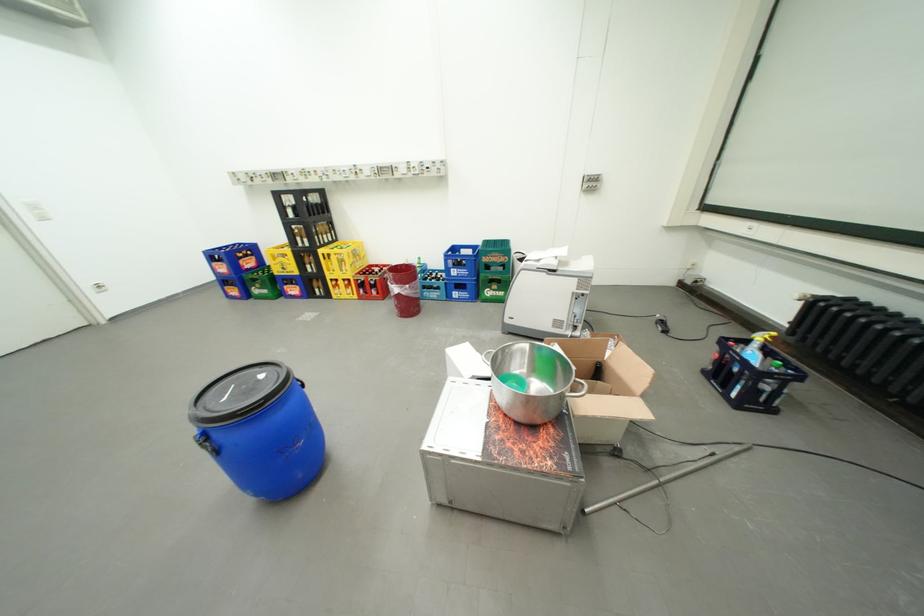
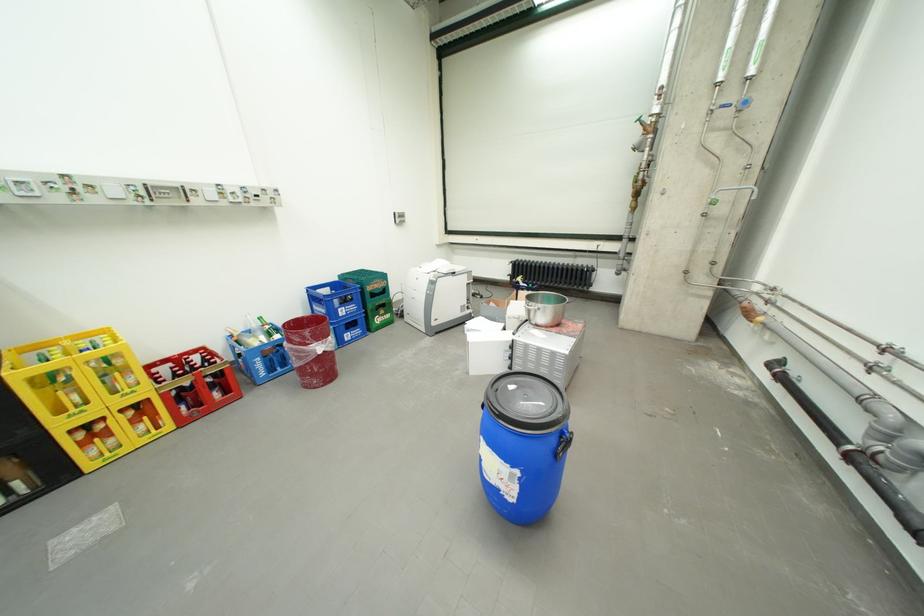
In the second image, find the point that corresponds to (x=505, y=257) in the first image.

(386, 285)